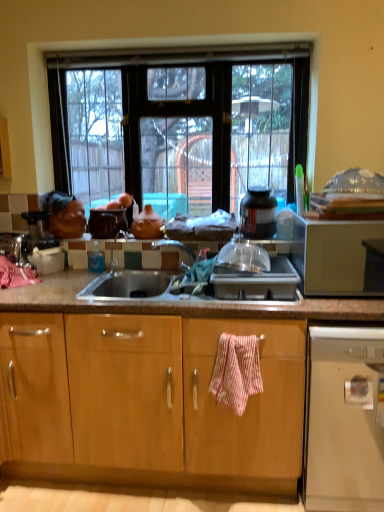
This screenshot has height=512, width=384. Describe the element at coordinates (106, 222) in the screenshot. I see `brown matte pot at center, positioned as the first appliance in left-to-right order` at that location.

Identify the location of black plastic container at upper center, the 1th appliance when ordered from right to left. This screenshot has width=384, height=512. (258, 213).

Identify the location of satin silver gas stove at center. The height and width of the screenshot is (512, 384). (257, 282).

What do you see at coordinates (188, 130) in the screenshot?
I see `transparent glass window at center` at bounding box center [188, 130].

Image resolution: width=384 pixels, height=512 pixels. Find the location of `brown matte pot at center, the second appliance in the right-to-left sequence`. brown matte pot at center, the second appliance in the right-to-left sequence is located at coordinates (106, 222).

From a real-world perspective, is matte clay pot at center located beneath black plastic container at upper center, the 1th appliance when ordered from right to left?

Yes.

From the image's perspective, does matte clay pot at center appear higher than black plastic container at upper center, the 2th appliance when ordered from left to right?

No, from the image's perspective, matte clay pot at center is not on top of black plastic container at upper center, the 2th appliance when ordered from left to right.

Is matte clay pot at center at the right side of black plastic container at upper center, the 2th appliance when ordered from left to right?

No, matte clay pot at center is not to the right of black plastic container at upper center, the 2th appliance when ordered from left to right.

How many degrees apart are the facing directions of matte clay pot at center and black plastic container at upper center, the 1th appliance when ordered from right to left?

1.81 degrees separate the facing orientations of matte clay pot at center and black plastic container at upper center, the 1th appliance when ordered from right to left.

Does transparent glass window at center have a lesser width compared to black plastic container at upper center, the 1th appliance when ordered from right to left?

Incorrect, the width of transparent glass window at center is not less than that of black plastic container at upper center, the 1th appliance when ordered from right to left.

From a real-world perspective, relative to black plastic container at upper center, the 1th appliance when ordered from right to left, is transparent glass window at center vertically above or below?

From a real-world perspective, transparent glass window at center is physically above black plastic container at upper center, the 1th appliance when ordered from right to left.

Considering the relative sizes of transparent glass window at center and black plastic container at upper center, the 2th appliance when ordered from left to right, in the image provided, is transparent glass window at center bigger than black plastic container at upper center, the 2th appliance when ordered from left to right,?

Indeed, transparent glass window at center has a larger size compared to black plastic container at upper center, the 2th appliance when ordered from left to right.

From the image's perspective, which object appears higher, pink striped towel at center or matte clay pot at center?

matte clay pot at center, from the image's perspective.

Identify the location of blanket below the matte clay pot at center (from the image's perspective). (236, 371).

Considering the relative sizes of pink striped towel at center and matte clay pot at center in the image provided, is pink striped towel at center bigger than matte clay pot at center?

Correct, pink striped towel at center is larger in size than matte clay pot at center.

Considering the positions of objects pink striped towel at center and matte clay pot at center in the image provided, who is in front, pink striped towel at center or matte clay pot at center?

pink striped towel at center is more forward.

From the image's perspective, which one is positioned lower, matte clay pot at center or pink striped towel at center?

pink striped towel at center appears lower in the image.

Where is `food above the pink striped towel at center (from the image's perspective)`? The height and width of the screenshot is (512, 384). food above the pink striped towel at center (from the image's perspective) is located at coordinates (147, 224).

Which is behind, matte clay pot at center or pink striped towel at center?

matte clay pot at center.

Can you confirm if black plastic container at upper center, the 1th appliance when ordered from right to left, is bigger than brown matte pot at center, positioned as the first appliance in left-to-right order?

Actually, black plastic container at upper center, the 1th appliance when ordered from right to left, might be smaller than brown matte pot at center, positioned as the first appliance in left-to-right order.

Which object is wider, black plastic container at upper center, the 1th appliance when ordered from right to left, or brown matte pot at center, positioned as the first appliance in left-to-right order?

brown matte pot at center, positioned as the first appliance in left-to-right order, is wider.

Is black plastic container at upper center, the 1th appliance when ordered from right to left, inside or outside of brown matte pot at center, the second appliance in the right-to-left sequence?

black plastic container at upper center, the 1th appliance when ordered from right to left, is not inside brown matte pot at center, the second appliance in the right-to-left sequence, it's outside.

Is black plastic container at upper center, the 1th appliance when ordered from right to left, turned away from brown matte pot at center, the second appliance in the right-to-left sequence?

No, black plastic container at upper center, the 1th appliance when ordered from right to left,'s orientation is not away from brown matte pot at center, the second appliance in the right-to-left sequence.

From a real-world perspective, is transparent glass window at center positioned above or below brown matte pot at center, positioned as the first appliance in left-to-right order?

transparent glass window at center is above brown matte pot at center, positioned as the first appliance in left-to-right order.

Does transparent glass window at center have a larger size compared to brown matte pot at center, positioned as the first appliance in left-to-right order?

Indeed, transparent glass window at center has a larger size compared to brown matte pot at center, positioned as the first appliance in left-to-right order.

Could you tell me if transparent glass window at center is facing brown matte pot at center, positioned as the first appliance in left-to-right order?

Yes, transparent glass window at center is turned towards brown matte pot at center, positioned as the first appliance in left-to-right order.

Considering the positions of points (112, 139) and (96, 213), is point (112, 139) closer to camera compared to point (96, 213)?

No, (112, 139) is behind (96, 213).

In the scene shown: From a real-world perspective, is brown matte pot at center, positioned as the first appliance in left-to-right order, above or below satin gold microwave at right?

brown matte pot at center, positioned as the first appliance in left-to-right order, is situated higher than satin gold microwave at right in the real world.

How different are the orientations of brown matte pot at center, the second appliance in the right-to-left sequence, and satin gold microwave at right in degrees?

0.63 degrees separate the facing orientations of brown matte pot at center, the second appliance in the right-to-left sequence, and satin gold microwave at right.

Find the location of `microwave oven directly beneath the brown matte pot at center, positioned as the first appliance in left-to-right order (from a real-world perspective)`. microwave oven directly beneath the brown matte pot at center, positioned as the first appliance in left-to-right order (from a real-world perspective) is located at coordinates (337, 257).

Is brown matte pot at center, positioned as the first appliance in left-to-right order, positioned with its back to satin gold microwave at right?

No.

Locate an element on the screen. food lying behind the black plastic container at upper center, the 1th appliance when ordered from right to left is located at coordinates (147, 224).

I want to click on appliance located in front of the transparent glass window at center, so click(258, 213).

In the scene shown: Which object lies further to the anchor point matte clay pot at center, satin gold microwave at right or white plastic dishwasher at lower right?

Based on the image, satin gold microwave at right appears to be further to matte clay pot at center.

In the scene shown: Which object lies nearer to the anchor point black plastic container at upper center, the 2th appliance when ordered from left to right, transparent glass window at center or satin silver gas stove at center?

The object closer to black plastic container at upper center, the 2th appliance when ordered from left to right, is satin silver gas stove at center.

Estimate the real-world distances between objects in this image. Which object is further from white plastic dishwasher at lower right, transparent glass window at center or matte clay pot at center?

Among the two, transparent glass window at center is located further to white plastic dishwasher at lower right.

From the image, which object appears to be farther from white plastic dishwasher at lower right, pink striped towel at center or matte clay pot at center?

Based on the image, matte clay pot at center appears to be further to white plastic dishwasher at lower right.

Which object lies further to the anchor point satin silver gas stove at center, matte clay pot at center or transparent glass window at center?

transparent glass window at center lies further to satin silver gas stove at center than the other object.

Based on their spatial positions, is matte clay pot at center or black plastic container at upper center, the 2th appliance when ordered from left to right, further from transparent glass window at center?

Based on the image, matte clay pot at center appears to be further to transparent glass window at center.

Looking at the image, which one is located closer to brown matte pot at center, positioned as the first appliance in left-to-right order, transparent glass window at center or matte clay pot at center?

matte clay pot at center is closer to brown matte pot at center, positioned as the first appliance in left-to-right order.

When comparing their distances from satin gold microwave at right, does transparent glass window at center or satin silver gas stove at center seem further?

satin silver gas stove at center.

Locate an element on the screen. gas stove between brown matte pot at center, the second appliance in the right-to-left sequence, and satin gold microwave at right is located at coordinates (257, 282).

The image size is (384, 512). I want to click on window between matte clay pot at center and satin gold microwave at right from left to right, so click(188, 130).

Identify the location of gas stove that lies between transparent glass window at center and white plastic dishwasher at lower right from top to bottom. (257, 282).

The image size is (384, 512). What are the coordinates of `microwave oven between matte clay pot at center and white plastic dishwasher at lower right` in the screenshot? It's located at (337, 257).